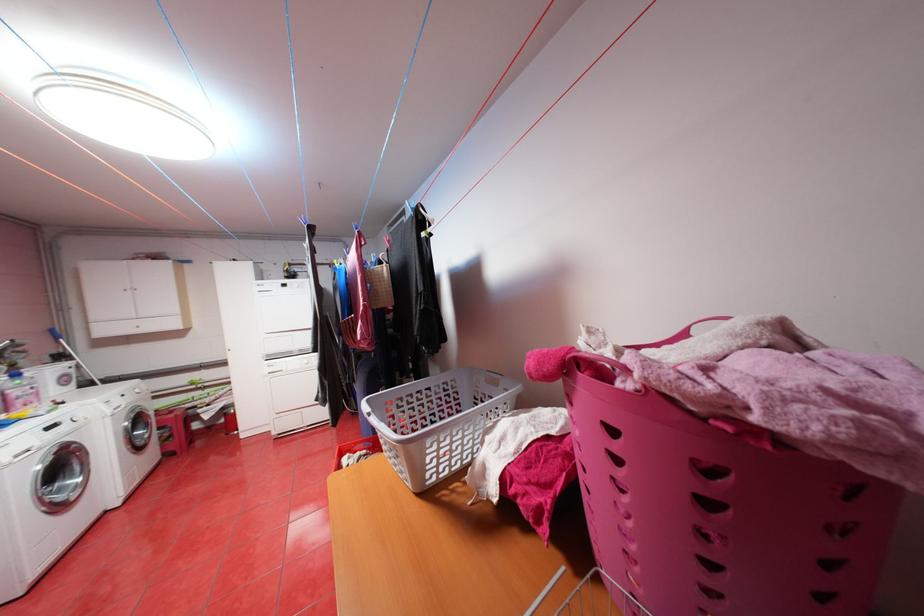
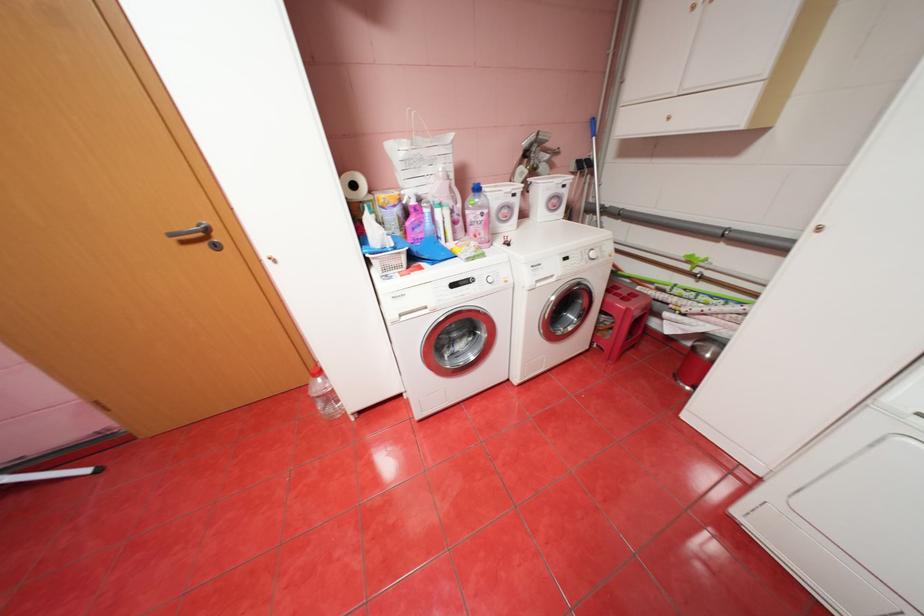
In the second image, find the point that corresponds to pixel 28 400 in the first image.

(480, 228)